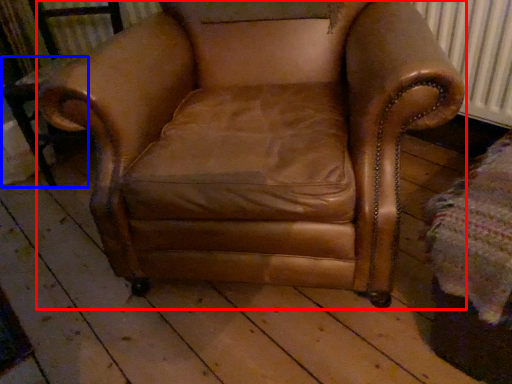
Question: Which of the following is the closest to the observer, chair (highlighted by a red box) or side table (highlighted by a blue box)?

Choices:
 (A) chair
 (B) side table

Answer: (A)